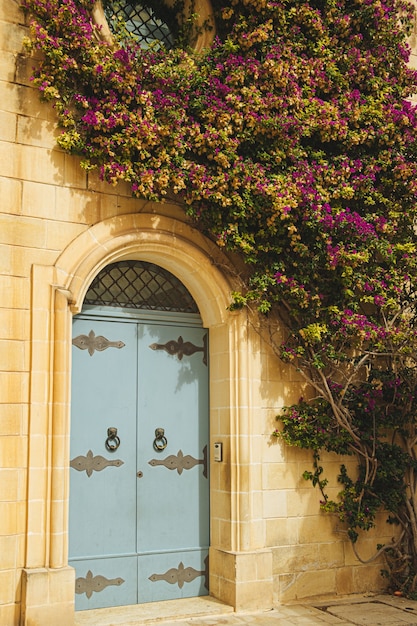
Identify the location of keypad entry. (216, 452).